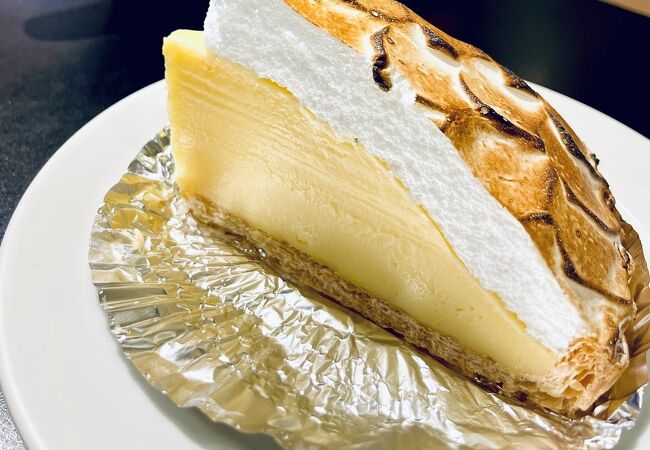
You are a GUI agent. You are given a task and a screenshot of the screen. Output one action in this format:
    pyautogui.click(x=<x>, y=<y>)
    Task: Click on the wall
    
    Given the screenshot: What is the action you would take?
    (639, 3)